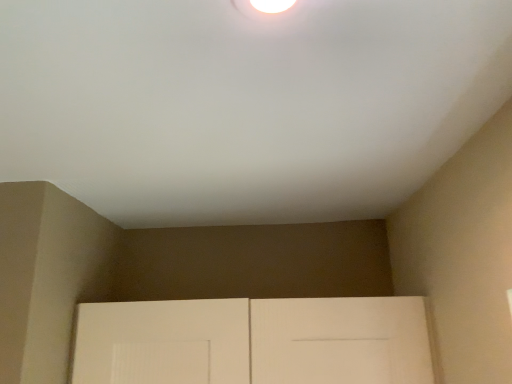
Question: Looking at the image, does white glossy droplight at upper center seem bigger or smaller compared to white matte door at lower center?

Choices:
 (A) big
 (B) small

Answer: (B)

Question: From a real-world perspective, relative to white matte door at lower center, is white glossy droplight at upper center vertically above or below?

Choices:
 (A) above
 (B) below

Answer: (A)

Question: Considering the positions of white glossy droplight at upper center and white matte door at lower center in the image, is white glossy droplight at upper center taller or shorter than white matte door at lower center?

Choices:
 (A) short
 (B) tall

Answer: (A)

Question: In the image, is white matte door at lower center positioned in front of or behind white glossy droplight at upper center?

Choices:
 (A) behind
 (B) front

Answer: (A)

Question: Is point (331, 319) positioned closer to the camera than point (298, 1)?

Choices:
 (A) closer
 (B) farther

Answer: (B)

Question: Choose the correct answer: Is white matte door at lower center inside white glossy droplight at upper center or outside it?

Choices:
 (A) outside
 (B) inside

Answer: (A)

Question: From their relative heights in the image, would you say white matte door at lower center is taller or shorter than white glossy droplight at upper center?

Choices:
 (A) short
 (B) tall

Answer: (B)